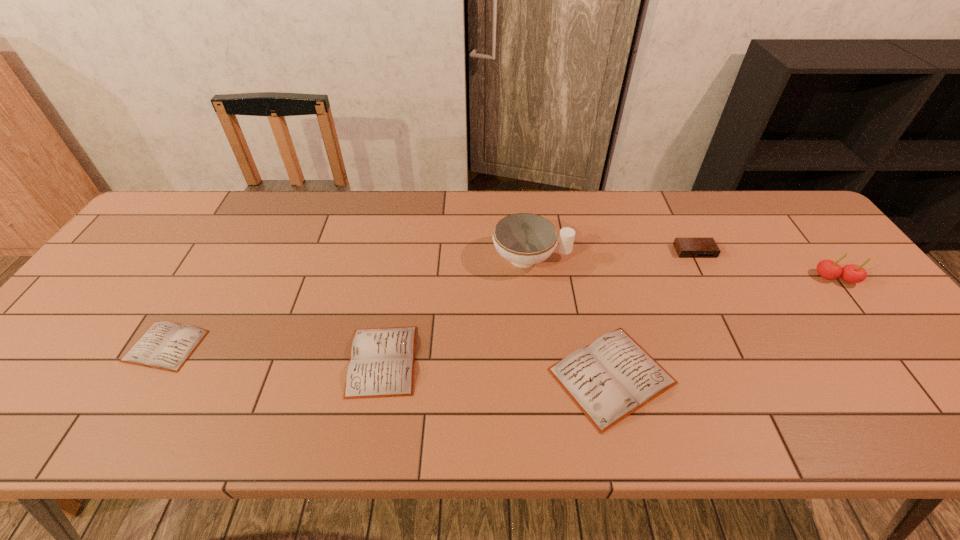
Image resolution: width=960 pixels, height=540 pixels. What are the coordinates of `vacant space at the left edge of the desktop` in the screenshot? It's located at (127, 274).

In the image, there is a desktop. At what (x,y) coordinates should I click in order to perform the action: click on vacant area at the right edge. Please return your answer as a coordinate pair (x, y). Looking at the image, I should click on (799, 251).

The height and width of the screenshot is (540, 960). What are the coordinates of `free location at the far right corner` in the screenshot? It's located at (782, 218).

Locate an element on the screen. unoccupied position between the second object from left to right and the shortest diary is located at coordinates (275, 353).

You are a GUI agent. You are given a task and a screenshot of the screen. Output one action in this format:
    pyautogui.click(x=<x>, y=<y>)
    Task: Click on the vacant area that lies between the rightmost diary and the cherry
    The image size is (960, 540).
    Given the screenshot: What is the action you would take?
    pyautogui.click(x=724, y=327)

Image resolution: width=960 pixels, height=540 pixels. In order to click on empty location between the fifth tallest object and the leftmost object in this screenshot , I will do `click(275, 353)`.

Where is `free space that is in between the tallest diary and the second tallest diary`? This screenshot has height=540, width=960. free space that is in between the tallest diary and the second tallest diary is located at coordinates (497, 368).

Where is `free spot between the third tallest object and the cherry`? Image resolution: width=960 pixels, height=540 pixels. free spot between the third tallest object and the cherry is located at coordinates (765, 265).

Find the location of `free space between the tallest diary and the rightmost object`. free space between the tallest diary and the rightmost object is located at coordinates (724, 327).

Locate an element on the screen. The image size is (960, 540). free space between the chinaware and the cherry is located at coordinates (684, 268).